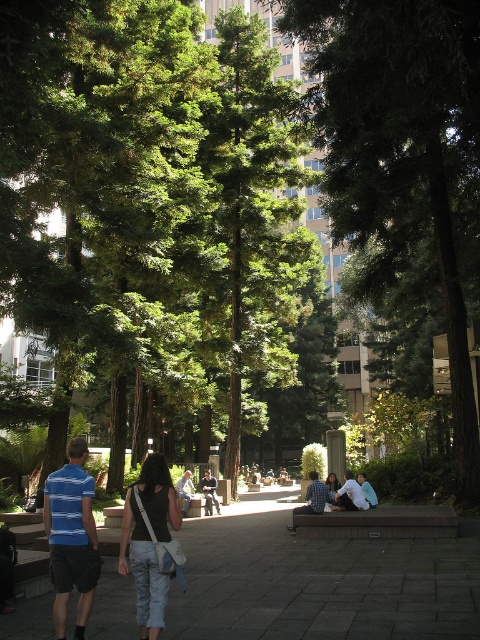
Question: Which point is closer to the camera?

Choices:
 (A) (328, 474)
 (B) (360, 493)
 (C) (124, 502)
 (D) (347, 488)

Answer: (C)

Question: Where is green leafy tree at center located in relation to blue striped shirt at center in the image?

Choices:
 (A) above
 (B) below

Answer: (A)

Question: Is blue denim jeans at center above dark gray fabric jacket at center?

Choices:
 (A) yes
 (B) no

Answer: (A)

Question: Is blue striped shirt at center closer to the viewer compared to dark gray fabric jacket at center?

Choices:
 (A) yes
 (B) no

Answer: (A)

Question: Which object is farther from the camera taking this photo?

Choices:
 (A) light blue shirt at lower right
 (B) denim jacket at center
 (C) denim pants at center
 (D) light brown wooden bench at center

Answer: (D)

Question: Estimate the real-world distances between objects in this image. Which object is farther from the light blue shirt at lower right?

Choices:
 (A) denim jacket at center
 (B) dark gray fabric jacket at center
 (C) green leafy tree at center

Answer: (B)